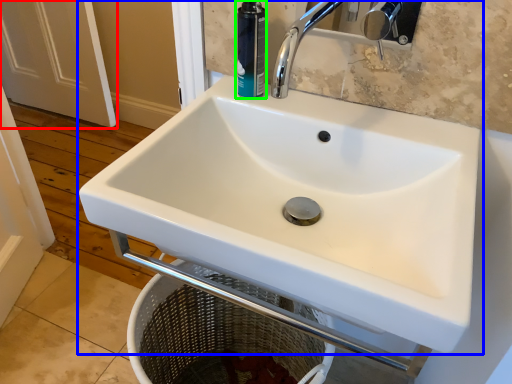
Question: Estimate the real-world distances between objects in this image. Which object is farther from screen door (highlighted by a red box), sink (highlighted by a blue box) or toiletry (highlighted by a green box)?

Choices:
 (A) sink
 (B) toiletry

Answer: (B)